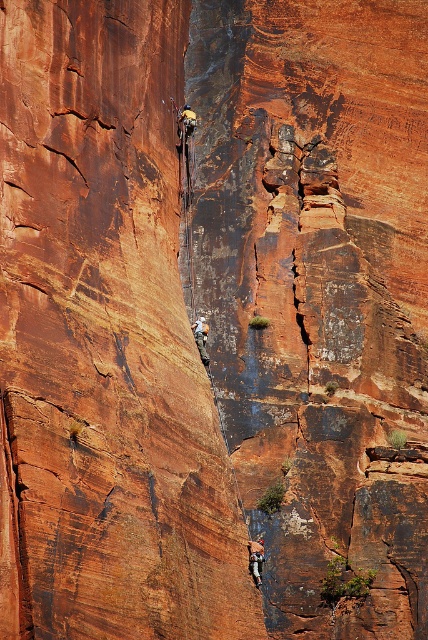
Can you confirm if matte climbing harness at center is positioned below matte gray rock climber at center?

Correct, matte climbing harness at center is located below matte gray rock climber at center.

Is the position of matte climbing harness at center less distant than that of matte gray rock climber at center?

That is True.

Find the location of a particular element. The width and height of the screenshot is (428, 640). matte climbing harness at center is located at coordinates [255, 560].